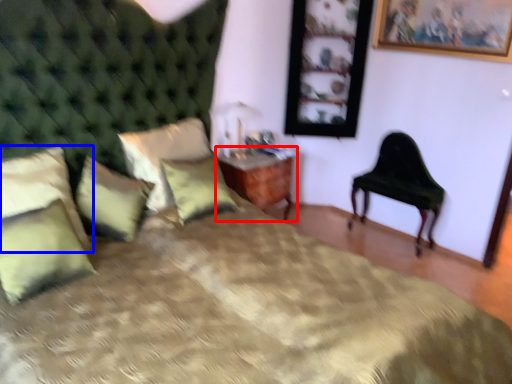
Question: Which of the following is the farthest to the observer, nightstand (highlighted by a red box) or pillow (highlighted by a blue box)?

Choices:
 (A) nightstand
 (B) pillow

Answer: (A)